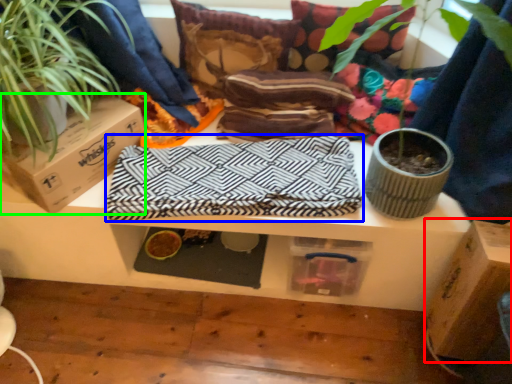
Question: Estimate the real-world distances between objects in this image. Which object is closer to cardboard box (highlighted by a red box), blanket (highlighted by a blue box) or cardboard box (highlighted by a green box)?

Choices:
 (A) blanket
 (B) cardboard box

Answer: (A)